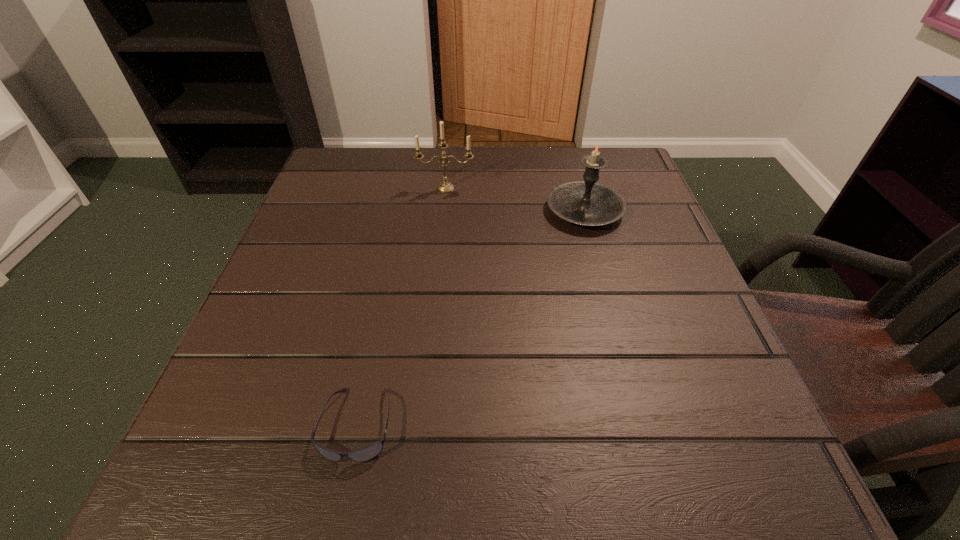
The height and width of the screenshot is (540, 960). In order to click on vacant region at the near edge of the desktop in this screenshot , I will do `click(369, 467)`.

Where is `vacant space at the left edge`? vacant space at the left edge is located at coordinates (283, 262).

You are a GUI agent. You are given a task and a screenshot of the screen. Output one action in this format:
    pyautogui.click(x=<x>, y=<y>)
    Task: Click on the blank space at the right edge
    
    Given the screenshot: What is the action you would take?
    pyautogui.click(x=644, y=373)

Identify the location of free space at the far right corner of the desktop. The width and height of the screenshot is (960, 540). (603, 151).

Where is `vacant space that's between the right candle and the shortest object`? vacant space that's between the right candle and the shortest object is located at coordinates (470, 318).

Where is `blank region between the shortest object and the right candle`? The image size is (960, 540). blank region between the shortest object and the right candle is located at coordinates (470, 318).

Locate an element on the screen. empty space that is in between the shortest object and the left candle is located at coordinates (401, 306).

Locate an element on the screen. This screenshot has height=540, width=960. free spot between the left candle and the nearest object is located at coordinates (401, 306).

Find the location of a particular element. This screenshot has width=960, height=540. free space between the shortest object and the left candle is located at coordinates tap(401, 306).

The height and width of the screenshot is (540, 960). I want to click on empty location between the left candle and the right candle, so click(515, 199).